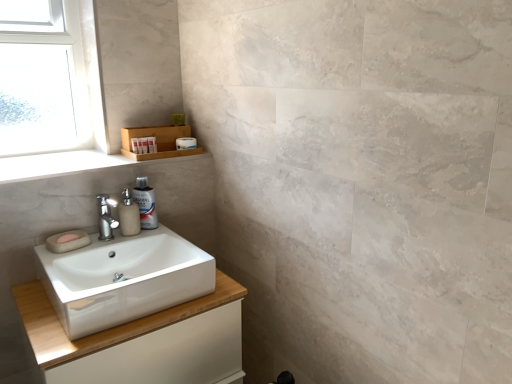
Question: Is white matte container at upper left, which is counted as the second toiletry, starting from the back, to the left of wooden shelf at upper left from the viewer's perspective?

Choices:
 (A) yes
 (B) no

Answer: (A)

Question: Considering the relative sizes of white matte container at upper left, which is counted as the 2th toiletry, starting from the right, and wooden shelf at upper left in the image provided, is white matte container at upper left, which is counted as the 2th toiletry, starting from the right, smaller than wooden shelf at upper left?

Choices:
 (A) yes
 (B) no

Answer: (A)

Question: Is white matte container at upper left, which is counted as the second toiletry, starting from the back, far away from wooden shelf at upper left?

Choices:
 (A) no
 (B) yes

Answer: (A)

Question: Considering the relative sizes of white matte container at upper left, which ranks as the 1th toiletry in front-to-back order, and wooden shelf at upper left in the image provided, is white matte container at upper left, which ranks as the 1th toiletry in front-to-back order, bigger than wooden shelf at upper left?

Choices:
 (A) no
 (B) yes

Answer: (A)

Question: Does white matte container at upper left, which is counted as the 2th toiletry, starting from the right, contain wooden shelf at upper left?

Choices:
 (A) yes
 (B) no

Answer: (B)

Question: Based on their sizes in the image, would you say polished chrome faucet at center is bigger or smaller than beige matte soap dispenser at center?

Choices:
 (A) big
 (B) small

Answer: (B)

Question: From the image's perspective, relative to beige matte soap dispenser at center, is polished chrome faucet at center above or below?

Choices:
 (A) above
 (B) below

Answer: (B)

Question: Is point (114, 221) positioned closer to the camera than point (138, 208)?

Choices:
 (A) closer
 (B) farther

Answer: (A)

Question: Based on their positions, is polished chrome faucet at center located to the left or right of beige matte soap dispenser at center?

Choices:
 (A) right
 (B) left

Answer: (B)

Question: In terms of width, does clear glass window at upper left look wider or thinner when compared to white glossy cabinet at lower left?

Choices:
 (A) thin
 (B) wide

Answer: (A)

Question: Considering their positions, is clear glass window at upper left located in front of or behind white glossy cabinet at lower left?

Choices:
 (A) front
 (B) behind

Answer: (B)

Question: Is clear glass window at upper left inside the boundaries of white glossy cabinet at lower left, or outside?

Choices:
 (A) inside
 (B) outside

Answer: (B)

Question: From their relative heights in the image, would you say clear glass window at upper left is taller or shorter than white glossy cabinet at lower left?

Choices:
 (A) short
 (B) tall

Answer: (A)

Question: From the image's perspective, is white glossy sink at lower left located above or below white matte container at upper left, marked as the 1th toiletry in a left-to-right arrangement?

Choices:
 (A) above
 (B) below

Answer: (B)

Question: Looking at the image, does white glossy sink at lower left seem bigger or smaller compared to white matte container at upper left, which is counted as the 2th toiletry, starting from the right?

Choices:
 (A) big
 (B) small

Answer: (A)